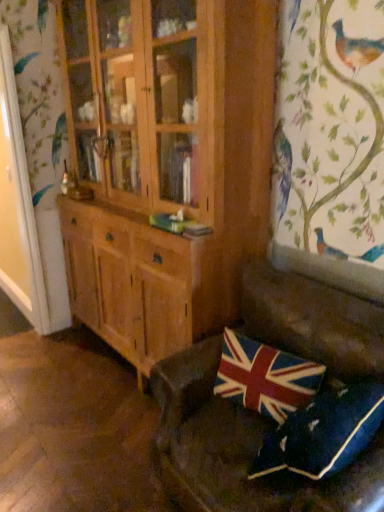
Question: In terms of height, does union jack fabric pillow at lower right, which appears as the first pillow when viewed from the back, look taller or shorter compared to velvet union jack pillow at lower right, the second pillow when ordered from back to front?

Choices:
 (A) short
 (B) tall

Answer: (A)

Question: From a real-world perspective, is union jack fabric pillow at lower right, the 2th pillow positioned from the front, above or below velvet union jack pillow at lower right, the second pillow when ordered from back to front?

Choices:
 (A) above
 (B) below

Answer: (A)

Question: Based on their relative distances, which object is nearer to the leather couch at lower right?

Choices:
 (A) union jack fabric pillow at lower right, which appears as the first pillow when viewed from the back
 (B) velvet union jack pillow at lower right, which appears as the first pillow when viewed from the front
 (C) wooden cabinet at center

Answer: (A)

Question: Estimate the real-world distances between objects in this image. Which object is closer to the union jack fabric pillow at lower right, the 2th pillow positioned from the front?

Choices:
 (A) velvet union jack pillow at lower right, which appears as the first pillow when viewed from the front
 (B) wooden cabinet at center
 (C) leather couch at lower right

Answer: (C)